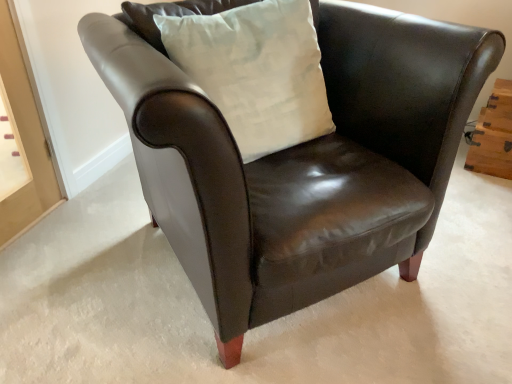
Where is `free spot in front of wooden drawer at right`? The width and height of the screenshot is (512, 384). free spot in front of wooden drawer at right is located at coordinates (485, 180).